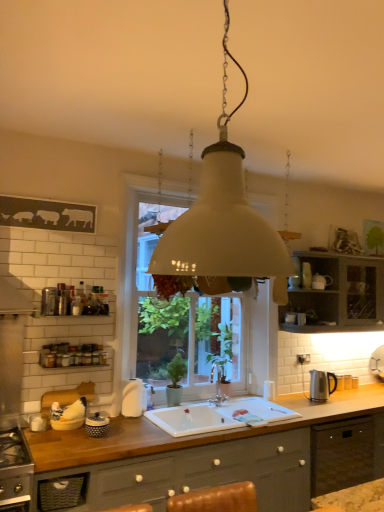
Question: From a real-world perspective, is wooden at lower center on top of satin nickel kettle at right, marked as the third appliance in a front-to-back arrangement?

Choices:
 (A) no
 (B) yes

Answer: (A)

Question: From the image's perspective, is wooden at lower center below satin nickel kettle at right, marked as the third appliance in a front-to-back arrangement?

Choices:
 (A) no
 (B) yes

Answer: (B)

Question: Considering the relative sizes of wooden at lower center and satin nickel kettle at right, which is the 1th appliance from back to front, in the image provided, is wooden at lower center bigger than satin nickel kettle at right, which is the 1th appliance from back to front,?

Choices:
 (A) yes
 (B) no

Answer: (A)

Question: Does wooden at lower center have a lesser width compared to satin nickel kettle at right, arranged as the 3th appliance when viewed from the left?

Choices:
 (A) no
 (B) yes

Answer: (A)

Question: Considering the relative positions of wooden at lower center and satin nickel kettle at right, which is the 1th appliance from back to front, in the image provided, is wooden at lower center to the left of satin nickel kettle at right, which is the 1th appliance from back to front, from the viewer's perspective?

Choices:
 (A) no
 (B) yes

Answer: (B)

Question: From a real-world perspective, is wooden at lower center physically below satin nickel kettle at right, marked as the third appliance in a front-to-back arrangement?

Choices:
 (A) no
 (B) yes

Answer: (B)

Question: Is white matte pendant light at center smaller than white matte soap dispenser at center, the 2th appliance positioned from the right?

Choices:
 (A) yes
 (B) no

Answer: (B)

Question: Is white matte pendant light at center oriented towards white matte soap dispenser at center, the second appliance positioned from the front?

Choices:
 (A) no
 (B) yes

Answer: (A)

Question: Considering the relative positions of white matte pendant light at center and white matte soap dispenser at center, which appears as the 2th appliance when viewed from the back, in the image provided, is white matte pendant light at center to the right of white matte soap dispenser at center, which appears as the 2th appliance when viewed from the back, from the viewer's perspective?

Choices:
 (A) yes
 (B) no

Answer: (A)

Question: From the image's perspective, is white matte pendant light at center beneath white matte soap dispenser at center, placed as the 2th appliance when sorted from left to right?

Choices:
 (A) no
 (B) yes

Answer: (A)

Question: Does white matte pendant light at center have a greater width compared to white matte soap dispenser at center, the second appliance positioned from the front?

Choices:
 (A) no
 (B) yes

Answer: (B)

Question: Is white matte pendant light at center far away from white matte soap dispenser at center, the second appliance positioned from the front?

Choices:
 (A) yes
 (B) no

Answer: (B)

Question: Is polka dot ceramic jar at lower left, the first appliance in the front-to-back sequence, with white glass window at center?

Choices:
 (A) yes
 (B) no

Answer: (B)